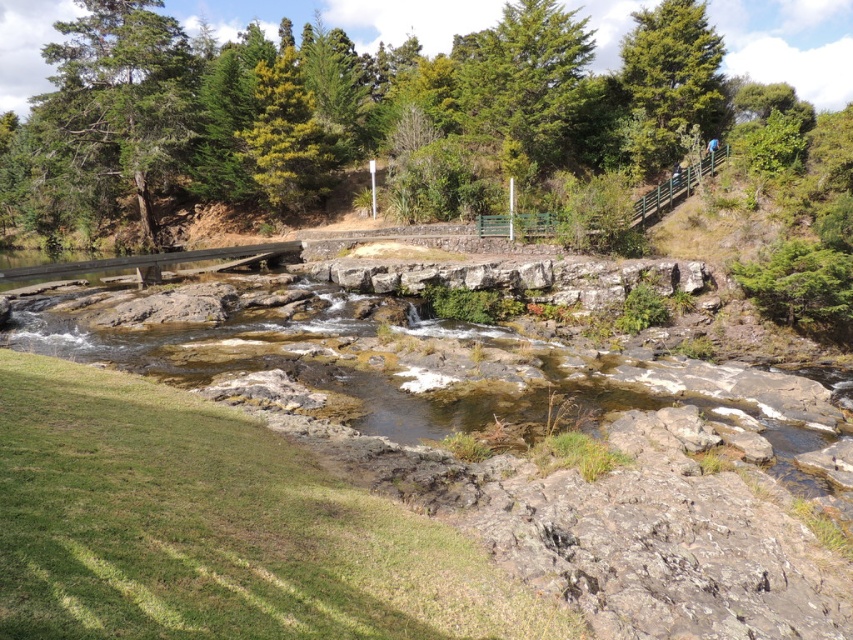
Question: Based on their relative distances, which object is farther from the rocky stream at center?

Choices:
 (A) green textured tree at upper right
 (B) green textured tree at upper center
 (C) green rough bark tree at upper left

Answer: (C)

Question: Can you confirm if green textured tree at upper center is smaller than green textured tree at upper right?

Choices:
 (A) yes
 (B) no

Answer: (B)

Question: Which of the following is the farthest from the observer?

Choices:
 (A) (660, 136)
 (B) (517, 156)

Answer: (A)

Question: Can you confirm if rocky stream at center is positioned to the left of green rough bark tree at upper left?

Choices:
 (A) no
 (B) yes

Answer: (A)

Question: Is green textured tree at upper center wider than green textured tree at upper right?

Choices:
 (A) no
 (B) yes

Answer: (B)

Question: Which object is the farthest from the green textured tree at upper center?

Choices:
 (A) rocky stream at center
 (B) green rough bark tree at upper left

Answer: (B)